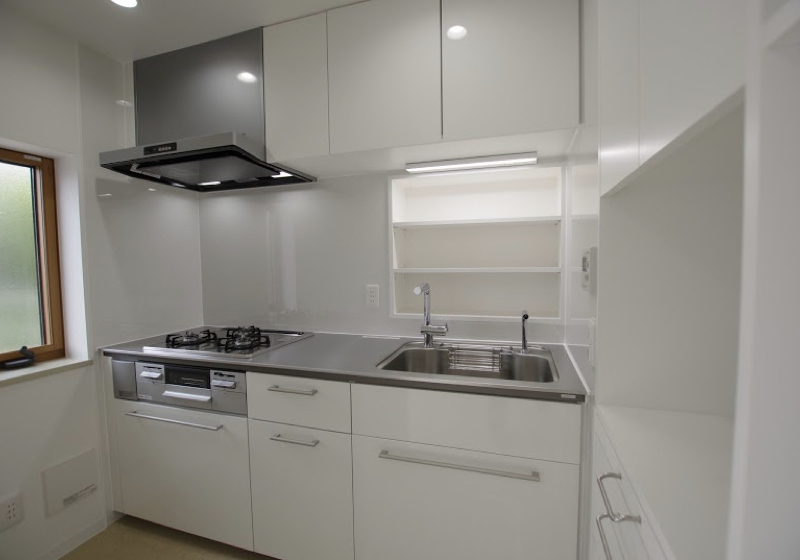
I want to click on cooktop, so click(214, 339).